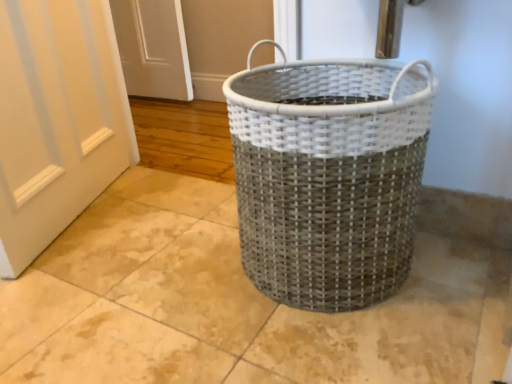
Identify the location of vacant area situated below white painted wood door at left (from a real-world perspective). This screenshot has width=512, height=384. (90, 212).